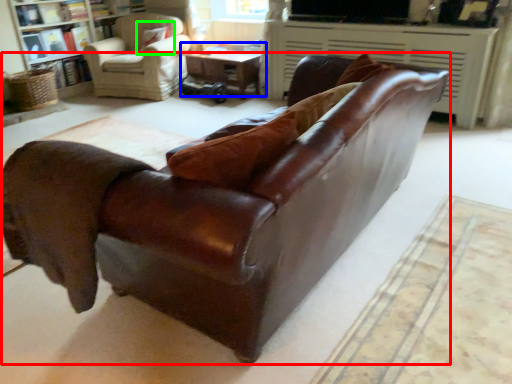
Question: Considering the real-world distances, which object is closest to studio couch (highlighted by a red box)? table (highlighted by a blue box) or pillow (highlighted by a green box).

Choices:
 (A) table
 (B) pillow

Answer: (A)